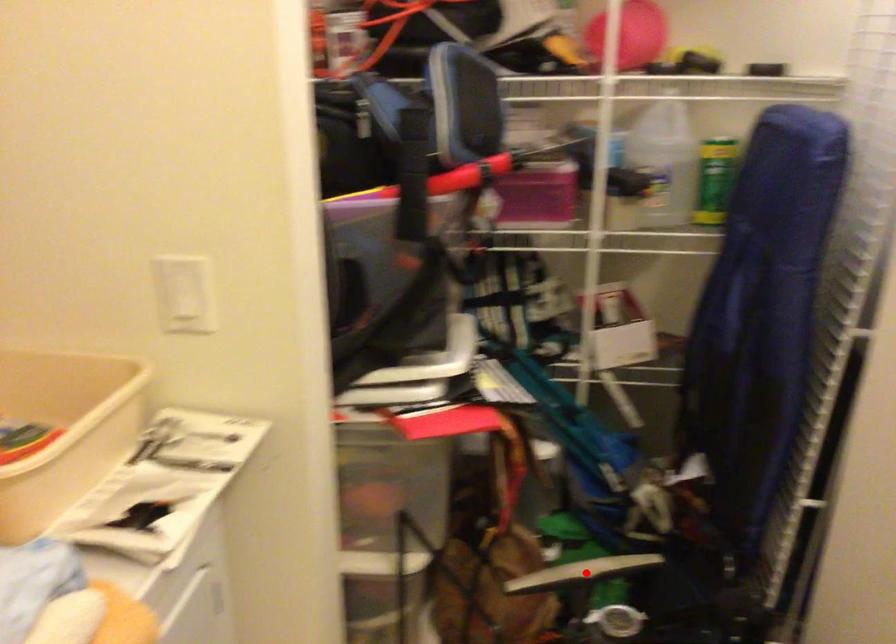
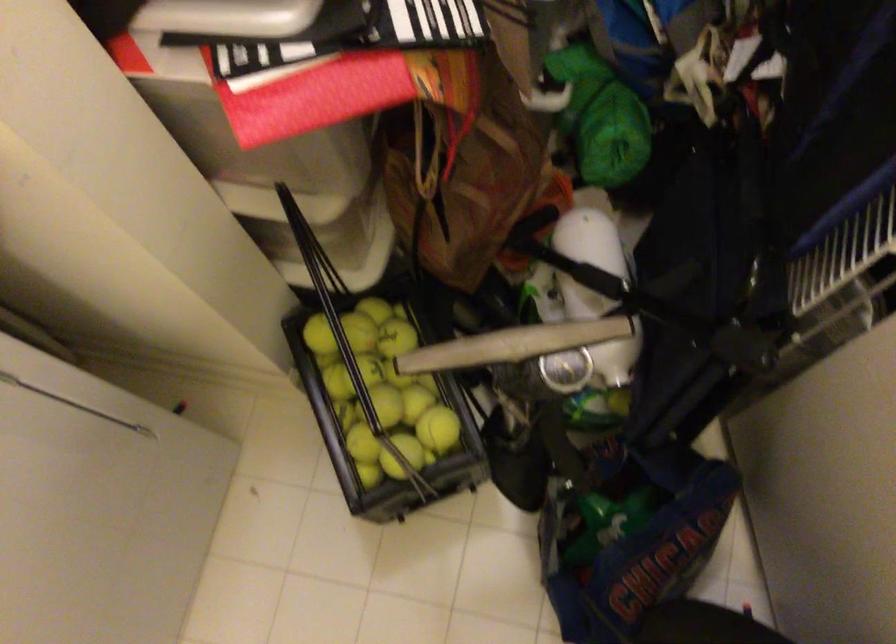
Question: I am providing you with two images of the same scene from different viewpoints. Given a red point in image1, look at the same physical point in image2. Is it:

Choices:
 (A) Closer to the viewpoint
 (B) Farther from the viewpoint

Answer: (A)